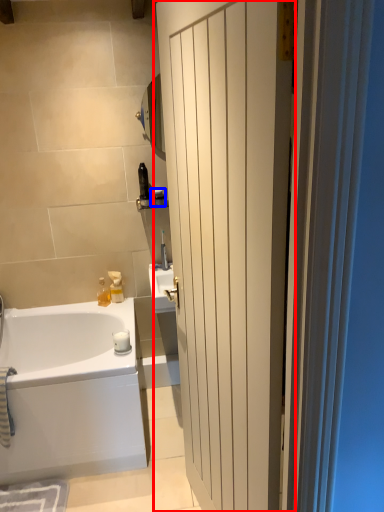
Question: Which object appears farthest to the camera in this image, door (highlighted by a red box) or toiletry (highlighted by a blue box)?

Choices:
 (A) door
 (B) toiletry

Answer: (B)